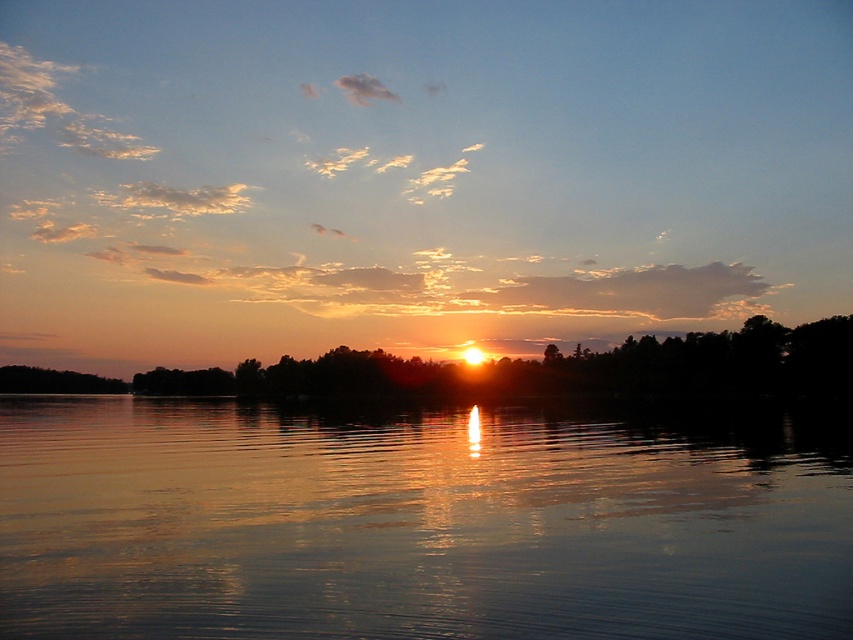
Does glistening water at center have a lesser width compared to silky black trees at center?

Yes.

Is glistening water at center in front of silky black trees at center?

Yes, glistening water at center is closer to the viewer.

Find the location of a particular element. glistening water at center is located at coordinates (415, 524).

Between reflective water surface at center and glistening water at center, which one has less height?

glistening water at center

Is reflective water surface at center taller than glistening water at center?

Yes, reflective water surface at center is taller than glistening water at center.

Who is more forward, [221,157] or [471,486]?

Point [471,486] is more forward.

The width and height of the screenshot is (853, 640). I want to click on reflective water surface at center, so click(415, 176).

Looking at this image, is the position of reflective water surface at center less distant than that of silky black trees at center?

That is False.

Is reflective water surface at center to the right of silky black trees at center from the viewer's perspective?

Indeed, reflective water surface at center is positioned on the right side of silky black trees at center.

Which is behind, point (137, 129) or point (328, 384)?

Positioned behind is point (137, 129).

What are the coordinates of `reflective water surface at center` in the screenshot? It's located at (415, 176).